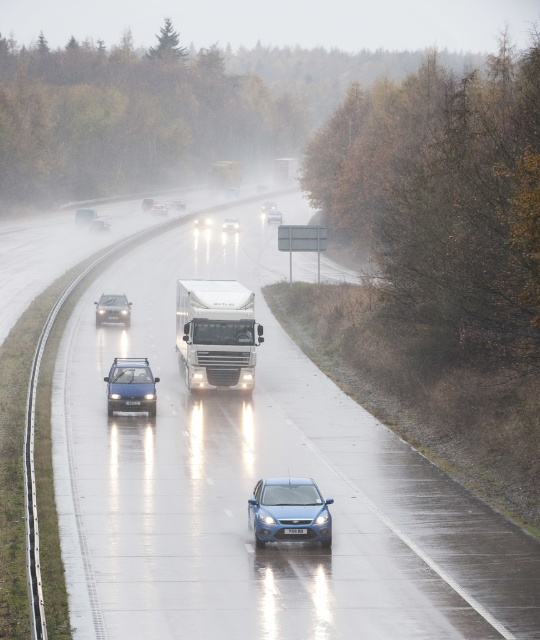
Which is above, glossy metallic car at center or glossy blue sedan at center?

glossy blue sedan at center is above.

Does glossy metallic car at center have a lesser width compared to glossy blue sedan at center?

No.

Is point (172, 314) positioned before point (266, 211)?

That is True.

Find the location of a particular element. The image size is (540, 640). glossy metallic car at center is located at coordinates (241, 467).

Who is shorter, glossy metallic car at center or satin silver convertible at center?

satin silver convertible at center is shorter.

Is glossy metallic car at center thinner than satin silver convertible at center?

No.

Is point (112, 436) in front of point (116, 316)?

Yes, it is in front of point (116, 316).

Where is `glossy metallic car at center`? The image size is (540, 640). glossy metallic car at center is located at coordinates (241, 467).

Who is higher up, white glossy trailer truck at center or satin silver convertible at center?

Positioned higher is satin silver convertible at center.

Between point (228, 349) and point (97, 314), which one is positioned behind?

The point (97, 314) is behind.

Looking at this image, who is more forward, (199, 342) or (96, 314)?

Positioned in front is point (199, 342).

At what (x,y) coordinates should I click in order to perform the action: click on white glossy trailer truck at center. Please return your answer as a coordinate pair (x, y). Looking at the image, I should click on (217, 333).